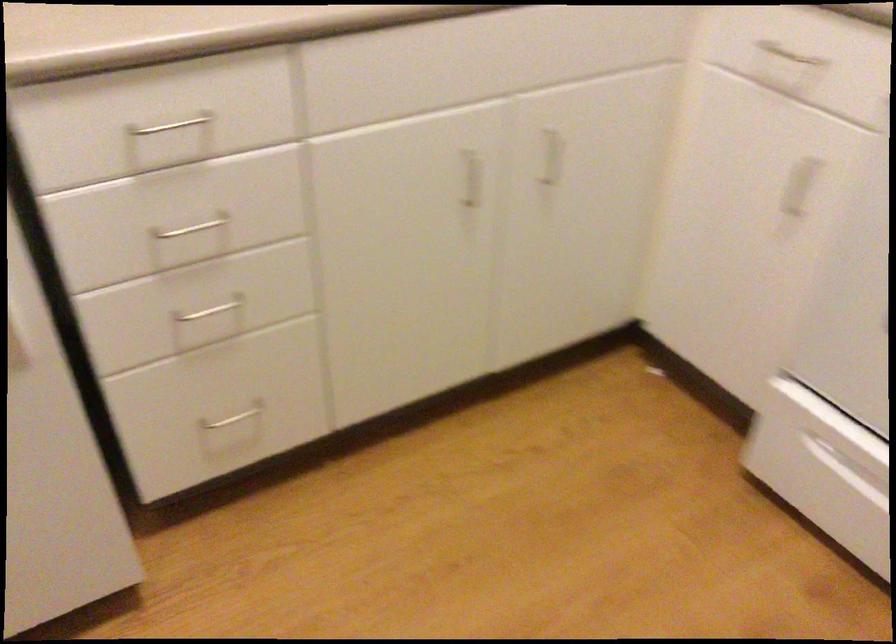
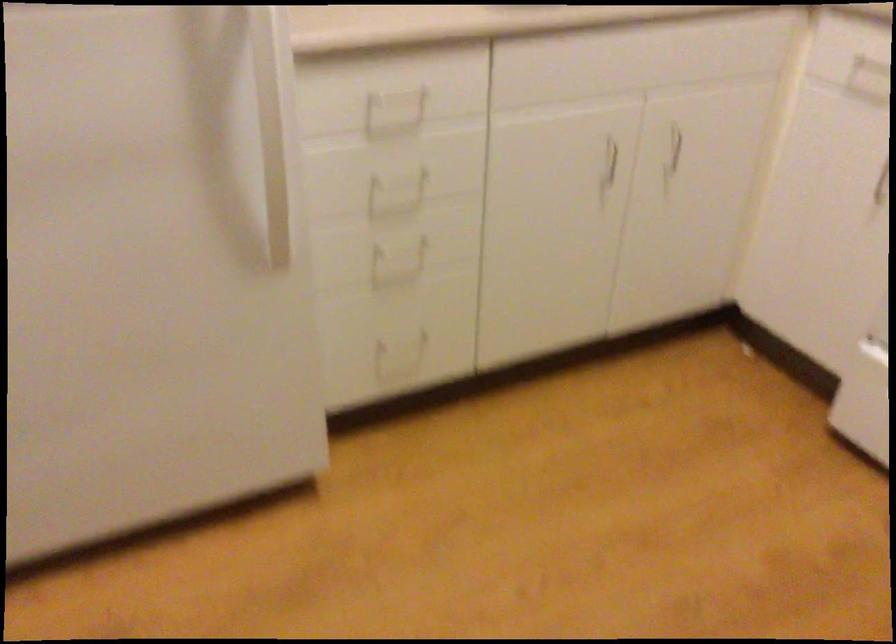
Where in the second image is the point corresponding to [210,225] from the first image?

(405, 178)